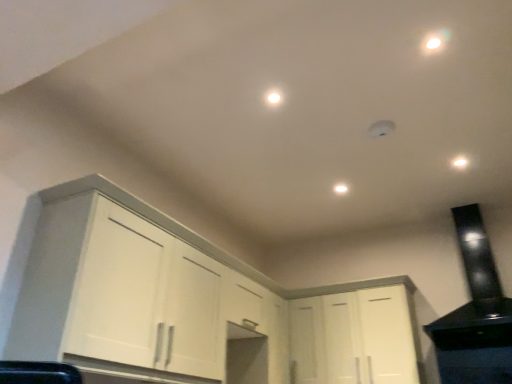
Question: Is white matte cabinet at center, which is counted as the second cabinetry, starting from the left, taller or shorter than white matte light fixture at center, arranged as the 2th dot when viewed from the front?

Choices:
 (A) tall
 (B) short

Answer: (A)

Question: Considering the positions of white matte cabinet at center, acting as the 1th cabinetry starting from the right, and white matte light fixture at center, the 1th dot in the right-to-left sequence, in the image, is white matte cabinet at center, acting as the 1th cabinetry starting from the right, bigger or smaller than white matte light fixture at center, the 1th dot in the right-to-left sequence,?

Choices:
 (A) small
 (B) big

Answer: (B)

Question: Which object is positioned closest to the white matte cabinet at center, which is counted as the second cabinetry, starting from the left?

Choices:
 (A) white matte cabinet at left, positioned as the first cabinetry in left-to-right order
 (B) white matte light fixture at center, which appears as the 1th dot when ordered from the bottom
 (C) white glossy light at center, the 2th dot in the back-to-front sequence
 (D) black glossy range hood at upper right

Answer: (D)

Question: Which of these objects is positioned farthest from the white matte light fixture at center, the 1th dot in the right-to-left sequence?

Choices:
 (A) black glossy range hood at upper right
 (B) white matte cabinet at left, acting as the second cabinetry starting from the right
 (C) white matte cabinet at center, acting as the 1th cabinetry starting from the right
 (D) white glossy light at center, which is the 2th dot from bottom to top

Answer: (B)